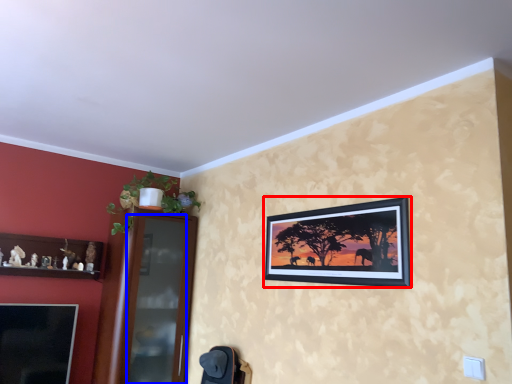
Question: Which point is further to the camera, picture frame (highlighted by a red box) or glass door (highlighted by a blue box)?

Choices:
 (A) picture frame
 (B) glass door

Answer: (B)